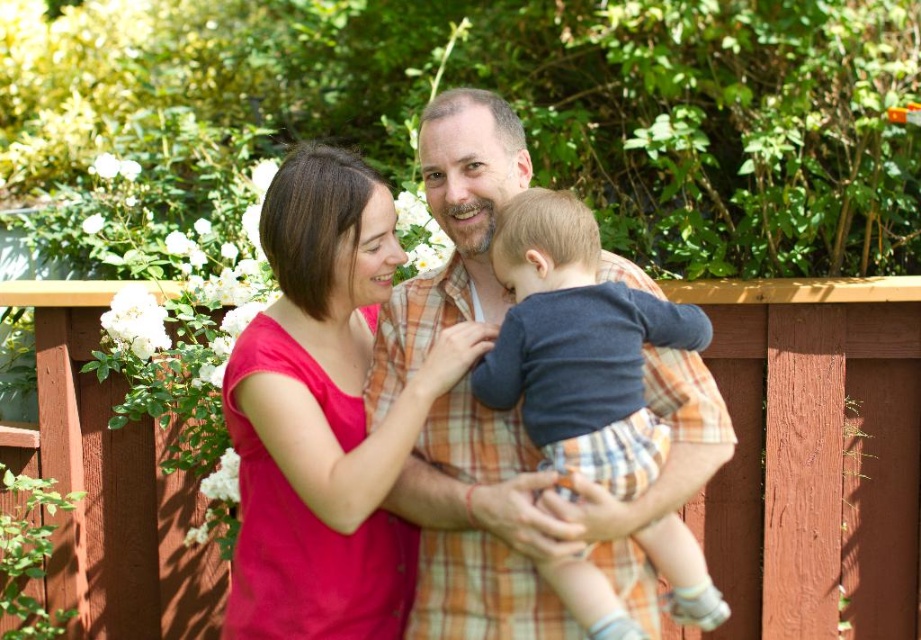
You are a photographer who wants to adjust the lighting so that the matte pink shirt at center and the matte orange plaid shirt at center are equally illuminated. Which direction should you move the light source to achieve this?

The matte pink shirt at center is to the left of the matte orange plaid shirt at center. To equally illuminate both, move the light source to the right of the center so that it can evenly reach both shirts.

You are a photographer trying to capture a closeup of the matte pink shirt at center and the dark blue cotton shirt at center. Which one should you focus on first if you want to ensure both shirts are in focus?

The matte pink shirt at center is further to the viewer than the dark blue cotton shirt at center, so you should focus on the matte pink shirt at center first to ensure both are in focus.